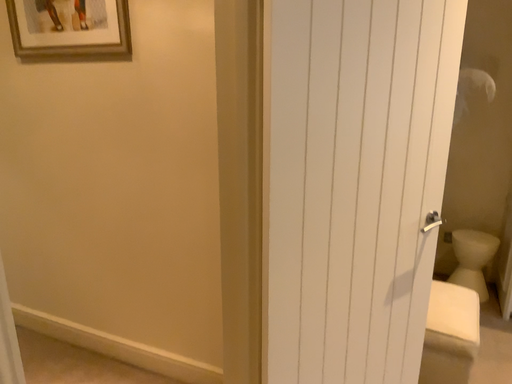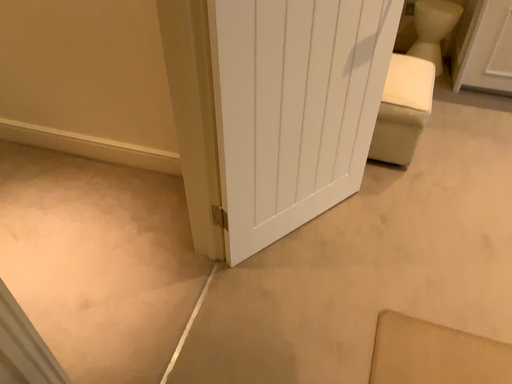
Question: How did the camera likely rotate when shooting the video?

Choices:
 (A) rotated right
 (B) rotated left

Answer: (A)